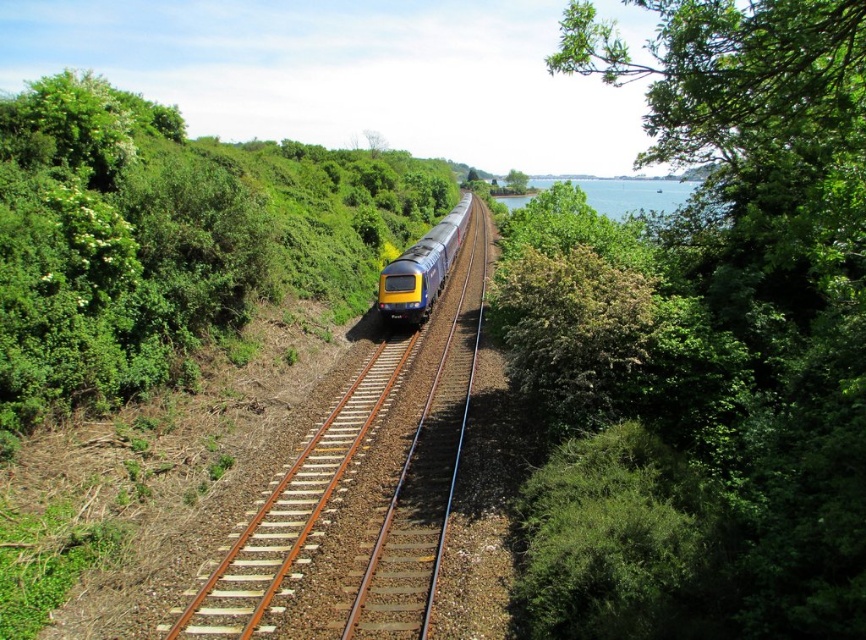
You are standing at the viewpoint of the image and want to determine which of the two points, point (260, 556) or point (512, 186), is nearer to you. Based on the scene, which point is closer?

Point (260, 556) is closer to the viewer than point (512, 186).

You are a photographer standing at the origin point of the coordinate system. You want to capture a photo of the yellowmetallictrain at center. According to the coordinates provided, in which direction should you move to position yourself directly in front of the train?

The yellowmetallictrain at center is located at point (292, 509). To position yourself directly in front of the train, you should move towards the positive x and positive y directions since the train is in the upper right quadrant relative to your current position at the origin.

You are a photographer standing at the edge of the railway tracks. You want to take a photo that includes both the yellowmetallictrain at center and the green leafy tree at upper center. Based on their positions, which object should appear lower in your photo?

The yellowmetallictrain at center appears lower in the photo because it is positioned below the green leafy tree at upper center.